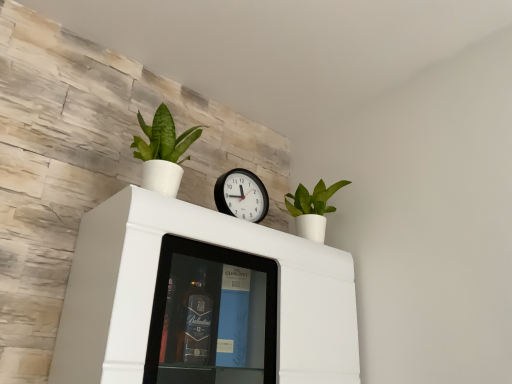
Question: Would you say green matte plant at upper right, marked as the second houseplant in a left-to-right arrangement, is outside white matte cabinet at upper center?

Choices:
 (A) yes
 (B) no

Answer: (A)

Question: Does green matte plant at upper right, arranged as the 2th houseplant when viewed from the front, have a greater width compared to white matte cabinet at upper center?

Choices:
 (A) yes
 (B) no

Answer: (B)

Question: Would you say white matte cabinet at upper center is part of green matte plant at upper right, the first houseplant in the back-to-front sequence,'s contents?

Choices:
 (A) yes
 (B) no

Answer: (B)

Question: From the image's perspective, is green matte plant at upper right, the first houseplant in the back-to-front sequence, located above white matte cabinet at upper center?

Choices:
 (A) no
 (B) yes

Answer: (B)

Question: From the image's perspective, is green matte plant at upper right, the first houseplant in the back-to-front sequence, beneath white matte cabinet at upper center?

Choices:
 (A) yes
 (B) no

Answer: (B)

Question: Based on their sizes in the image, would you say green matte plant at upper left, which appears as the 1th houseplant when viewed from the front, is bigger or smaller than black plastic wall clock at center?

Choices:
 (A) small
 (B) big

Answer: (B)

Question: Is green matte plant at upper left, acting as the first houseplant starting from the left, taller or shorter than black plastic wall clock at center?

Choices:
 (A) short
 (B) tall

Answer: (B)

Question: From the image's perspective, relative to black plastic wall clock at center, is green matte plant at upper left, which appears as the 1th houseplant when viewed from the front, above or below?

Choices:
 (A) below
 (B) above

Answer: (B)

Question: Is green matte plant at upper left, acting as the first houseplant starting from the left, inside the boundaries of black plastic wall clock at center, or outside?

Choices:
 (A) outside
 (B) inside

Answer: (A)

Question: From a real-world perspective, is white matte cabinet at upper center above or below green matte plant at upper left, acting as the first houseplant starting from the left?

Choices:
 (A) below
 (B) above

Answer: (A)

Question: Based on their positions, is white matte cabinet at upper center located to the left or right of green matte plant at upper left, which appears as the 1th houseplant when viewed from the front?

Choices:
 (A) right
 (B) left

Answer: (A)

Question: Which is correct: white matte cabinet at upper center is inside green matte plant at upper left, the second houseplant viewed from the right, or outside of it?

Choices:
 (A) outside
 (B) inside

Answer: (A)

Question: Is point (260, 306) closer or farther from the camera than point (170, 188)?

Choices:
 (A) closer
 (B) farther

Answer: (B)

Question: In terms of size, does black plastic wall clock at center appear bigger or smaller than white matte cabinet at upper center?

Choices:
 (A) small
 (B) big

Answer: (A)

Question: In the image, is black plastic wall clock at center on the left side or the right side of white matte cabinet at upper center?

Choices:
 (A) right
 (B) left

Answer: (A)